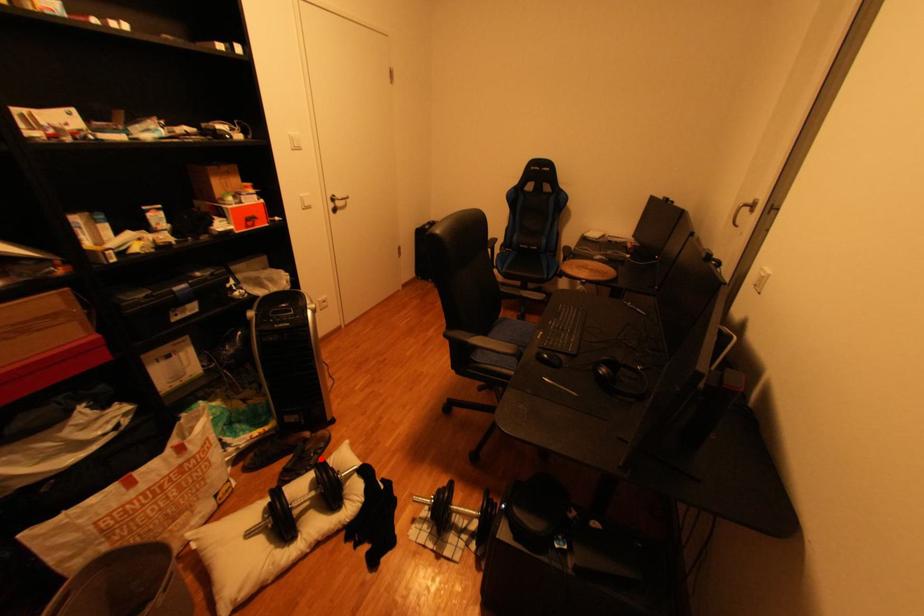
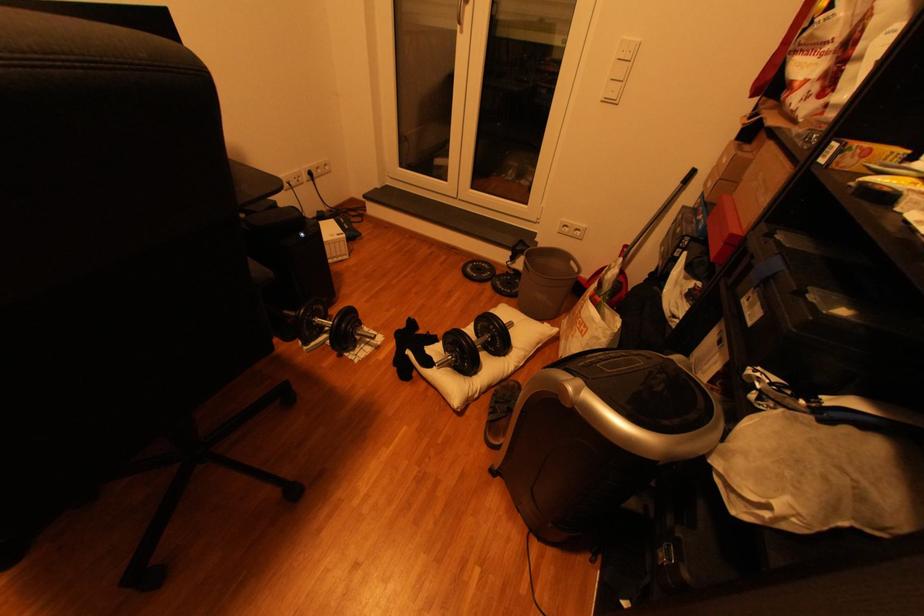
Locate, in the second image, the point that corresponds to the highlighted location in the first image.

(505, 402)